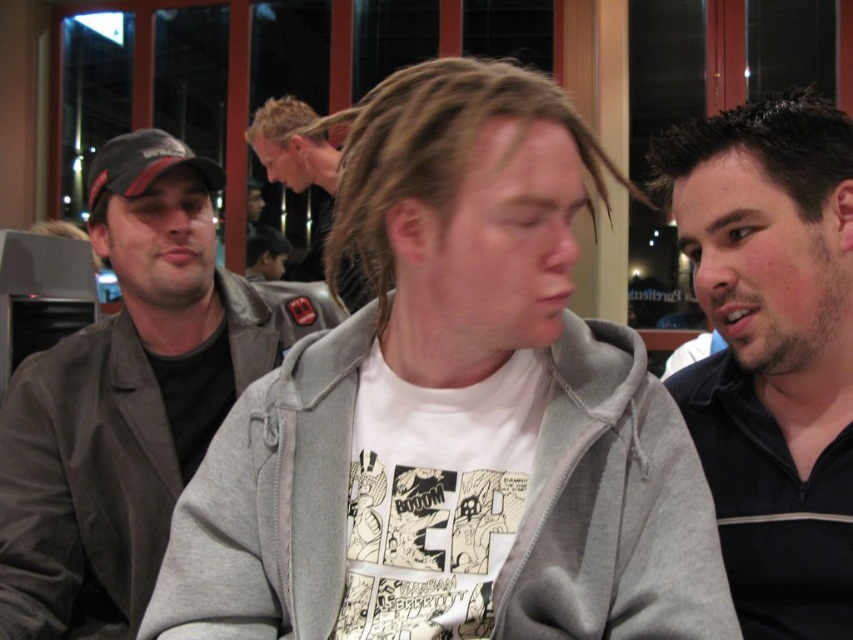
In the scene shown: You are a photographer trying to capture a clear shot of the dark brown hair at right and the light brown hair at center. Based on their positions, which hair is more likely to be in the foreground of the photo?

The dark brown hair at right is below the light brown hair at center, so the dark brown hair at right is in the foreground.

In the scene shown: Based on the coordinates provided, where is the gray hoodie at center located in the image?

The gray hoodie at center is located at coordinates point (451, 408).